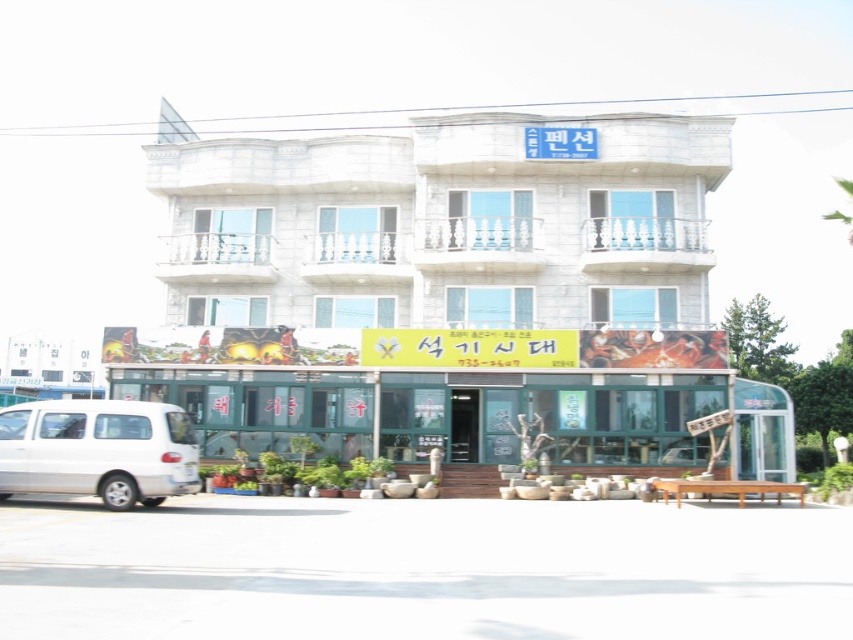
Is white stone building at center further to camera compared to white matte van at lower left?

Yes, it is.

Which is behind, point (573, 202) or point (67, 417)?

Positioned behind is point (573, 202).

The height and width of the screenshot is (640, 853). Identify the location of white stone building at center. (450, 285).